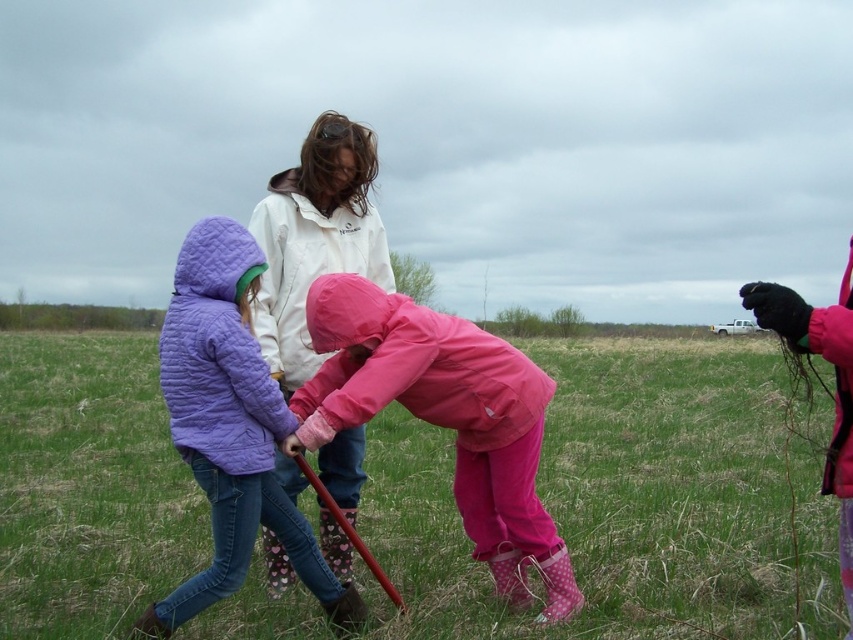
You are a photographer trying to capture both the pink matte raincoat at center and the quilted purple jacket at center in a single frame. Which object should you focus on first to ensure both are in the frame?

You should focus on the pink matte raincoat at center first because it is larger in size than the quilted purple jacket at center, ensuring it fits within the frame while the smaller jacket also remains visible.

From the picture: You are a photographer trying to capture the quilted purple jacket at center and the green grass at center in the same frame. Based on their positions, which object is located to the left of the other?

The green grass at center is to the left of the quilted purple jacket at center.

You are standing at the edge of the grassy field and want to reach the green grass at center. Which direction should you walk to get there?

You should walk towards the center of the field to reach the green grass at center, as it is located at point coordinates of (607, 499).